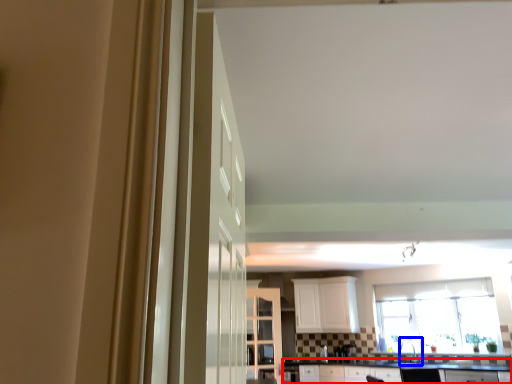
Question: Which object appears farthest to the camera in this image, countertop (highlighted by a red box) or sink (highlighted by a blue box)?

Choices:
 (A) countertop
 (B) sink

Answer: (B)